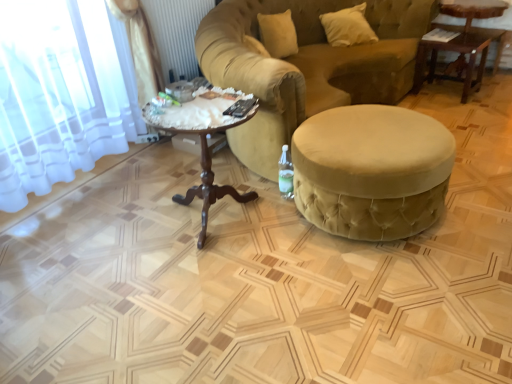
Question: Is mahogany wood coffee table at center to the left of white soft pillow at upper right from the viewer's perspective?

Choices:
 (A) yes
 (B) no

Answer: (A)

Question: Can you confirm if mahogany wood coffee table at center is thinner than white soft pillow at upper right?

Choices:
 (A) yes
 (B) no

Answer: (B)

Question: Considering the relative sizes of mahogany wood coffee table at center and white soft pillow at upper right in the image provided, is mahogany wood coffee table at center shorter than white soft pillow at upper right?

Choices:
 (A) no
 (B) yes

Answer: (A)

Question: Does mahogany wood coffee table at center appear on the right side of white soft pillow at upper right?

Choices:
 (A) yes
 (B) no

Answer: (B)

Question: Are mahogany wood coffee table at center and white soft pillow at upper right located far from each other?

Choices:
 (A) no
 (B) yes

Answer: (B)

Question: Is white soft pillow at upper right a part of mahogany wood coffee table at center?

Choices:
 (A) no
 (B) yes

Answer: (A)

Question: Considering the relative positions of clear glass bottle at lower right and white soft pillow at upper right in the image provided, is clear glass bottle at lower right to the right of white soft pillow at upper right from the viewer's perspective?

Choices:
 (A) yes
 (B) no

Answer: (B)

Question: Is clear glass bottle at lower right not inside white soft pillow at upper right?

Choices:
 (A) yes
 (B) no

Answer: (A)

Question: Is clear glass bottle at lower right at the left side of white soft pillow at upper right?

Choices:
 (A) no
 (B) yes

Answer: (B)

Question: Is clear glass bottle at lower right behind white soft pillow at upper right?

Choices:
 (A) no
 (B) yes

Answer: (A)

Question: Does clear glass bottle at lower right have a lesser height compared to white soft pillow at upper right?

Choices:
 (A) yes
 (B) no

Answer: (A)

Question: Is clear glass bottle at lower right bigger than white soft pillow at upper right?

Choices:
 (A) yes
 (B) no

Answer: (B)

Question: Is mahogany wood coffee table at center closer to camera compared to wooden table at upper right, acting as the first table starting from the right?

Choices:
 (A) yes
 (B) no

Answer: (A)